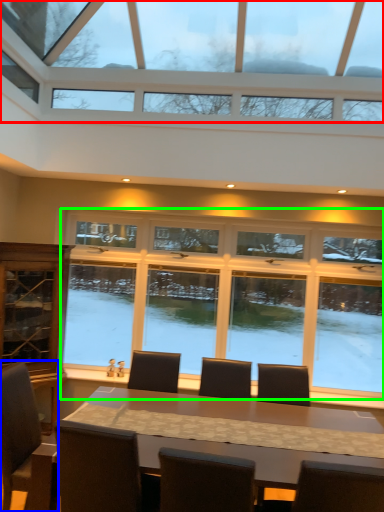
Question: Considering the real-world distances, which object is closest to window (highlighted by a red box)? chair (highlighted by a blue box) or window (highlighted by a green box).

Choices:
 (A) chair
 (B) window

Answer: (B)